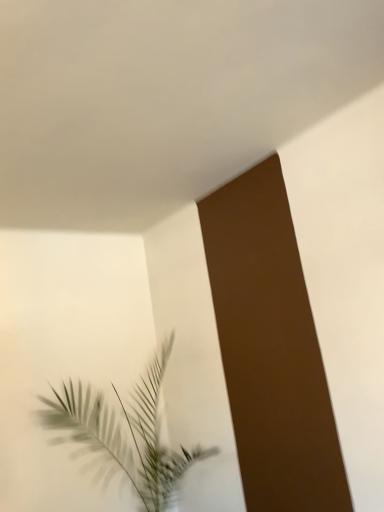
What do you see at coordinates (124, 436) in the screenshot?
I see `green leafy plant at lower left` at bounding box center [124, 436].

At what (x,y) coordinates should I click in order to perform the action: click on green leafy plant at lower left. Please return your answer as a coordinate pair (x, y). Looking at the image, I should click on (124, 436).

Identify the location of green leafy plant at lower left. (124, 436).